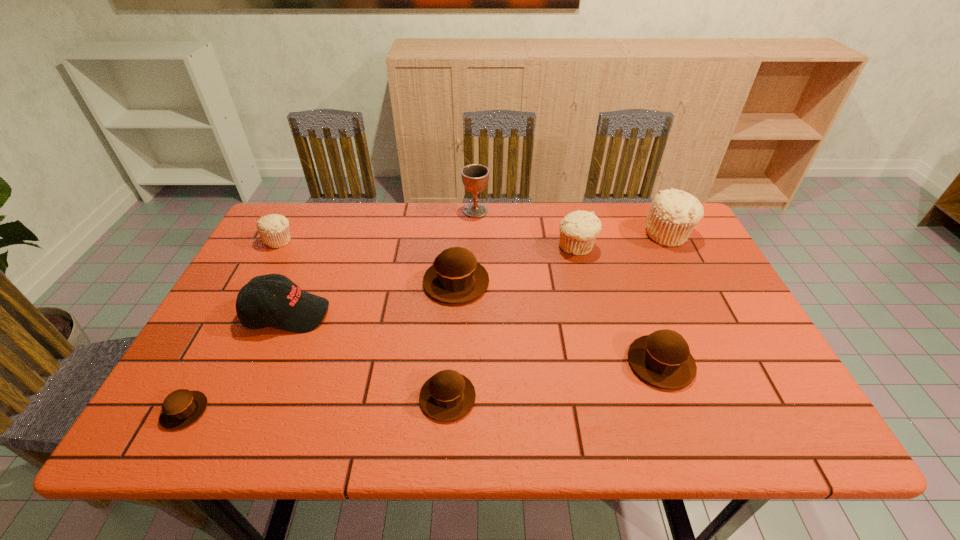
You are a GUI agent. You are given a task and a screenshot of the screen. Output one action in this format:
    pyautogui.click(x=<x>, y=<y>)
    Task: Click on the sixth tallest muffin
    Image resolution: width=960 pixels, height=540 pixels.
    Given the screenshot: What is the action you would take?
    pyautogui.click(x=447, y=396)

The height and width of the screenshot is (540, 960). What are the coordinates of `the eighth tallest object` in the screenshot? It's located at (447, 396).

Where is `the shortest muffin`? The image size is (960, 540). the shortest muffin is located at coordinates (181, 408).

Identify the location of the shortest object. (181, 408).

Identify the location of vacant space located 0.160m on the right of the brown chalice. (538, 211).

What are the coordinates of `free space located 0.310m on the front of the rightmost beige muffin` in the screenshot? It's located at (716, 329).

The image size is (960, 540). Find the location of `vacant area situated on the right of the second beige muffin from right to left`. vacant area situated on the right of the second beige muffin from right to left is located at coordinates (613, 247).

What are the coordinates of `vacant space located on the front-facing side of the baseball cap` in the screenshot? It's located at (475, 314).

The height and width of the screenshot is (540, 960). Find the location of `vacant space located 0.200m on the right of the farthest brown muffin`. vacant space located 0.200m on the right of the farthest brown muffin is located at coordinates (563, 282).

In order to click on vacant space located on the right of the smallest beige muffin in this screenshot , I will do `click(425, 240)`.